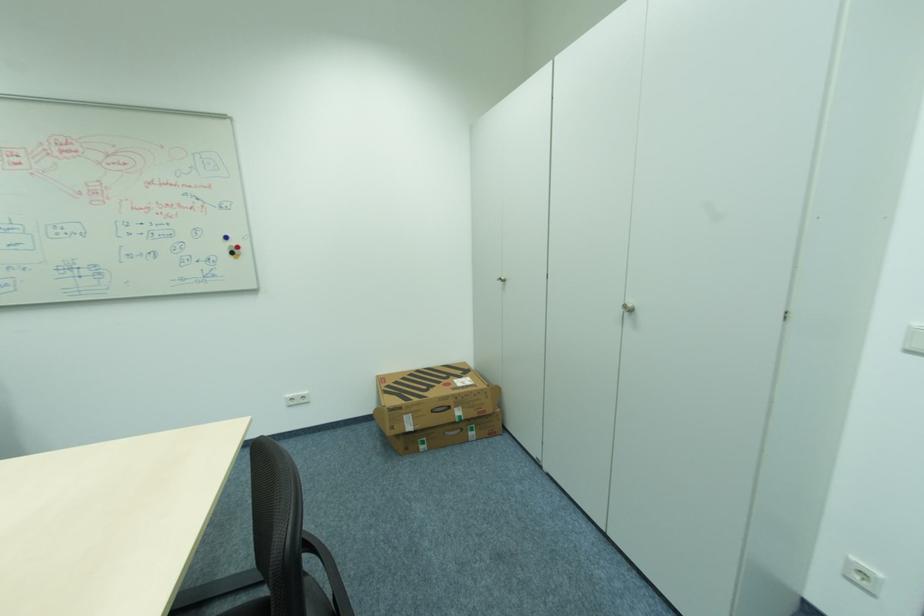
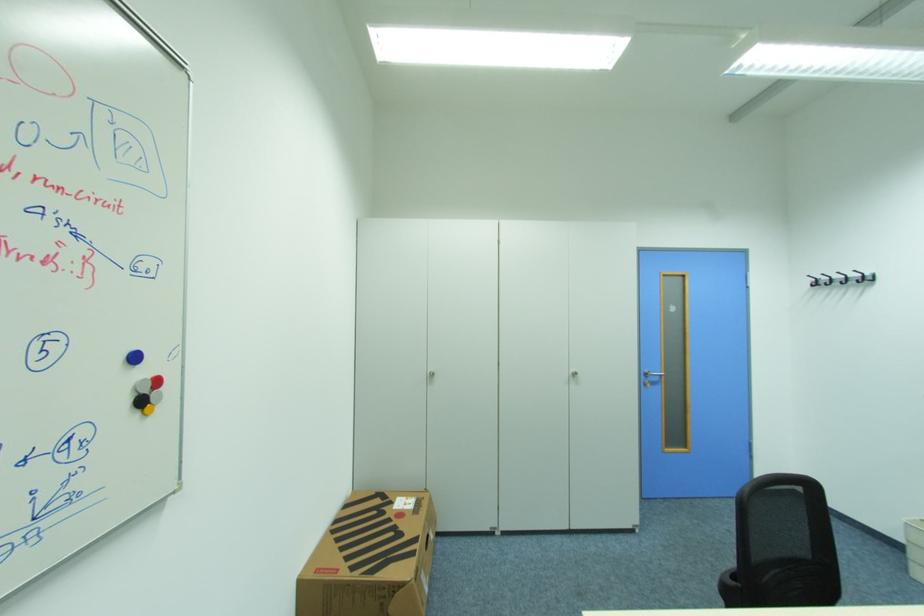
Find the pixel in the second image that matches the point at 233,238 in the first image.

(140, 359)